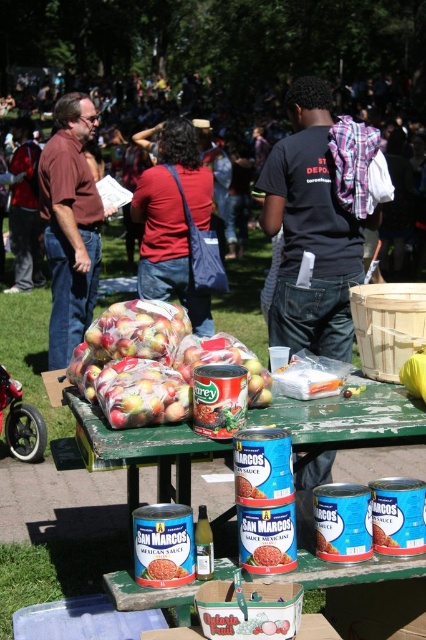
Question: Among these points, which one is farthest from the camera?

Choices:
 (A) (314, 234)
 (B) (181, 577)
 (C) (161, 262)

Answer: (C)

Question: Which point appears farthest from the camera in this image?

Choices:
 (A) (31, 289)
 (B) (276, 557)
 (C) (360, 419)
 (D) (224, 113)

Answer: (D)

Question: Which point is closer to the camera?

Choices:
 (A) brown shirt at left
 (B) matte brown shirt at left

Answer: (A)

Question: Does blue plastic table at center come in front of smooth red sauce can at center?

Choices:
 (A) no
 (B) yes

Answer: (B)

Question: Does matte black shirt at upper center have a larger size compared to brown shirt at left?

Choices:
 (A) yes
 (B) no

Answer: (A)

Question: Does blue plastic table at center have a greater width compared to matte brown shirt at left?

Choices:
 (A) no
 (B) yes

Answer: (A)